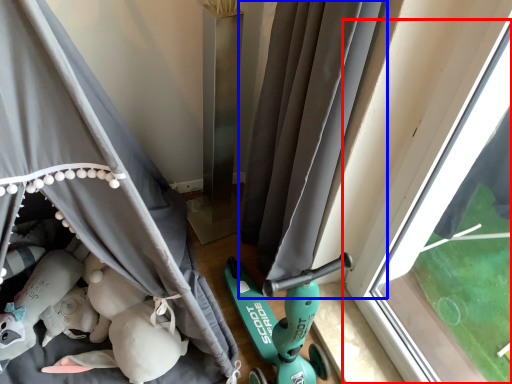
Question: Which point is closer to the camera, window (highlighted by a red box) or curtain (highlighted by a blue box)?

Choices:
 (A) window
 (B) curtain

Answer: (A)